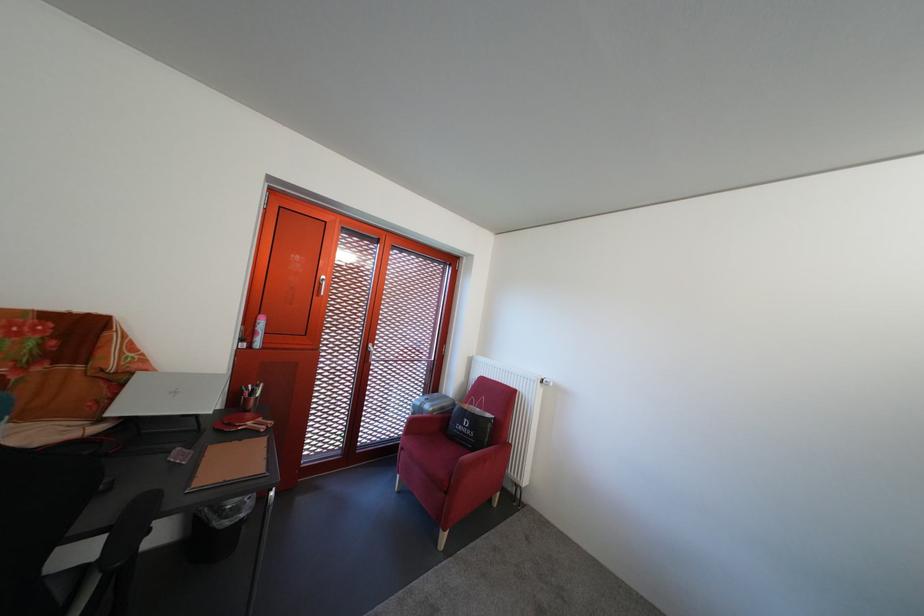
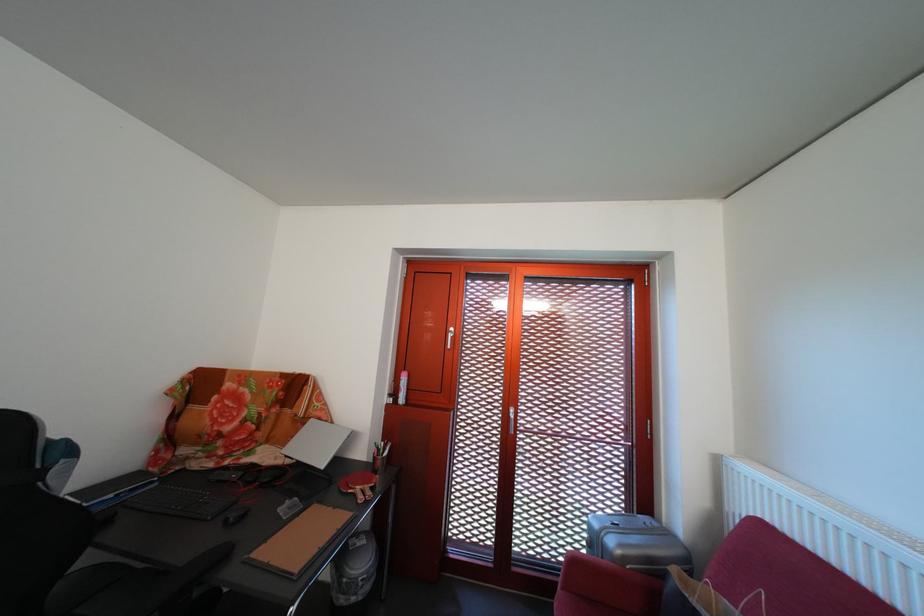
Question: The first image is from the beginning of the video and the second image is from the end. How did the camera likely rotate when shooting the video?

Choices:
 (A) Left
 (B) Right
 (C) Up
 (D) Down

Answer: (A)